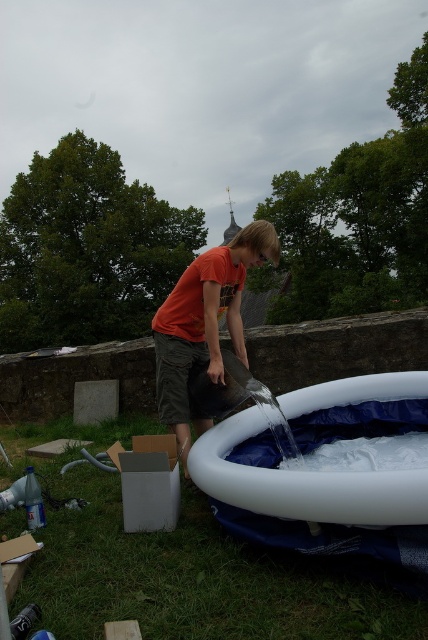
Question: Can you confirm if white inflatable tub at lower center is positioned to the right of orange t-shirt at center?

Choices:
 (A) no
 (B) yes

Answer: (B)

Question: Among these objects, which one is nearest to the camera?

Choices:
 (A) white inflatable tub at lower center
 (B) orange t-shirt at center

Answer: (A)

Question: Does white inflatable tub at lower center have a smaller size compared to orange t-shirt at center?

Choices:
 (A) no
 (B) yes

Answer: (B)

Question: Considering the relative positions of white inflatable tub at lower center and orange t-shirt at center in the image provided, where is white inflatable tub at lower center located with respect to orange t-shirt at center?

Choices:
 (A) left
 (B) right

Answer: (B)